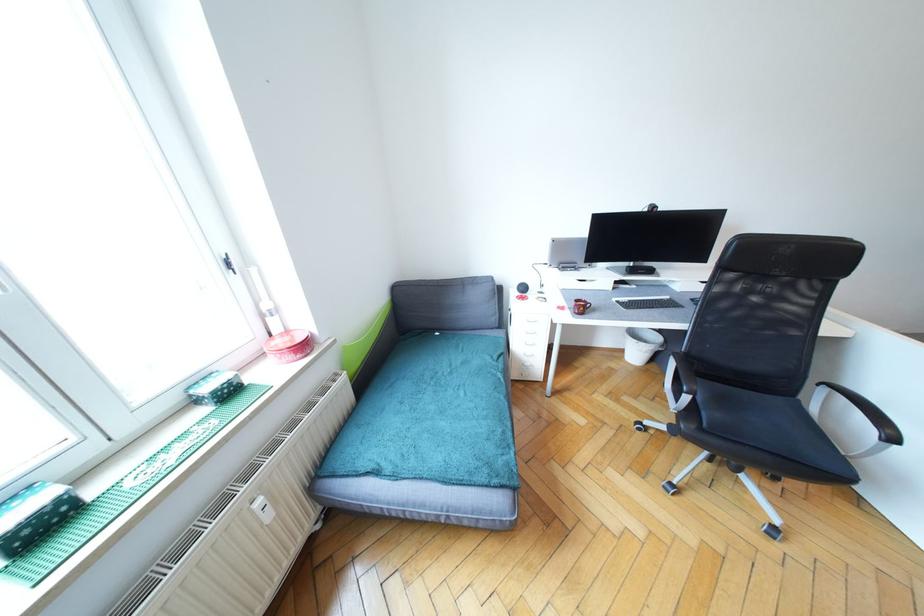
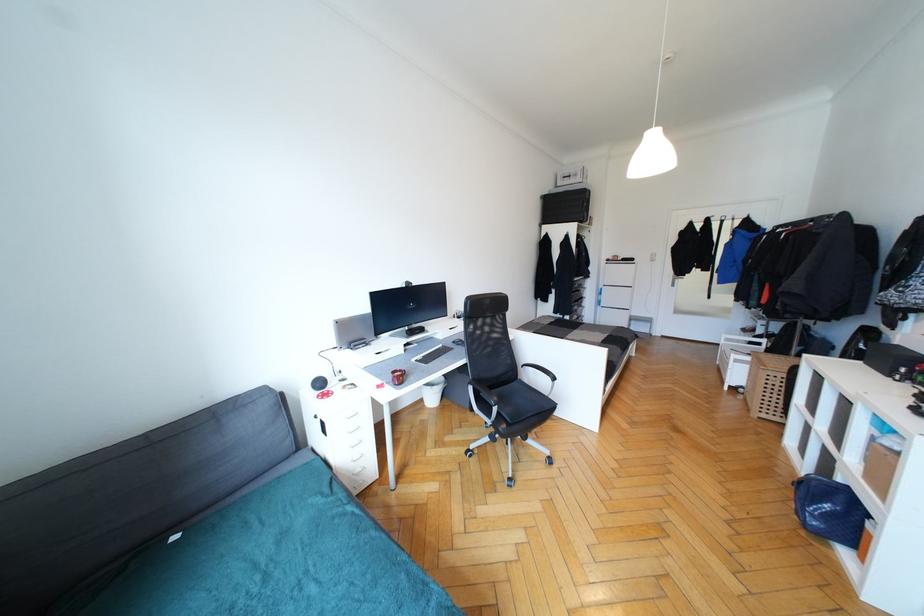
Question: The camera is either moving clockwise (left) or counter-clockwise (right) around the object. The first image is from the beginning of the video and the second image is from the end. Is the camera moving left or right when shooting the video?

Choices:
 (A) Left
 (B) Right

Answer: (A)